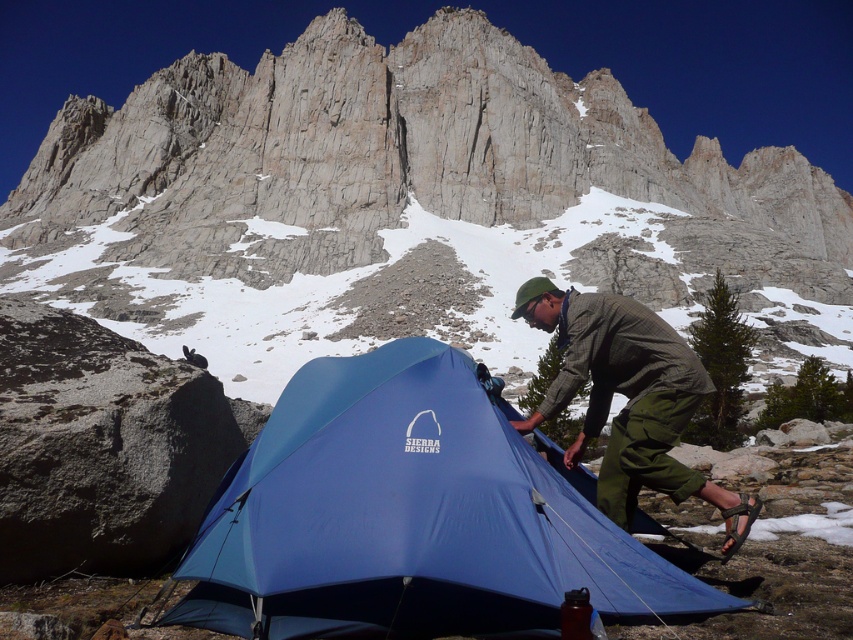
Question: Observing the image, what is the correct spatial positioning of blue nylon tent at center in reference to green plaid shirt at center?

Choices:
 (A) left
 (B) right

Answer: (A)

Question: Which point is farther to the camera?

Choices:
 (A) (578, 323)
 (B) (256, 572)

Answer: (A)

Question: Does blue nylon tent at center have a greater width compared to green plaid shirt at center?

Choices:
 (A) yes
 (B) no

Answer: (A)

Question: From the image, what is the correct spatial relationship of blue nylon tent at center in relation to green plaid shirt at center?

Choices:
 (A) right
 (B) left

Answer: (B)

Question: Which point appears farthest from the camera in this image?

Choices:
 (A) (482, 499)
 (B) (747, 508)

Answer: (B)